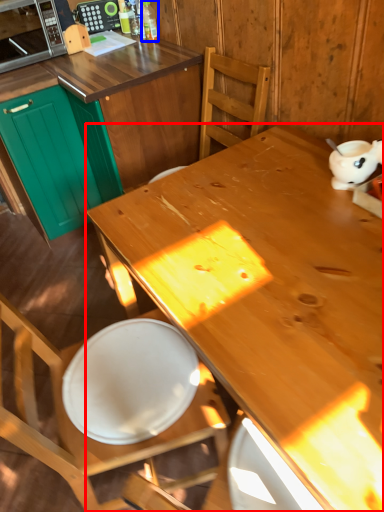
Question: Which object is closer to the camera taking this photo, desk (highlighted by a red box) or bottle (highlighted by a blue box)?

Choices:
 (A) desk
 (B) bottle

Answer: (A)